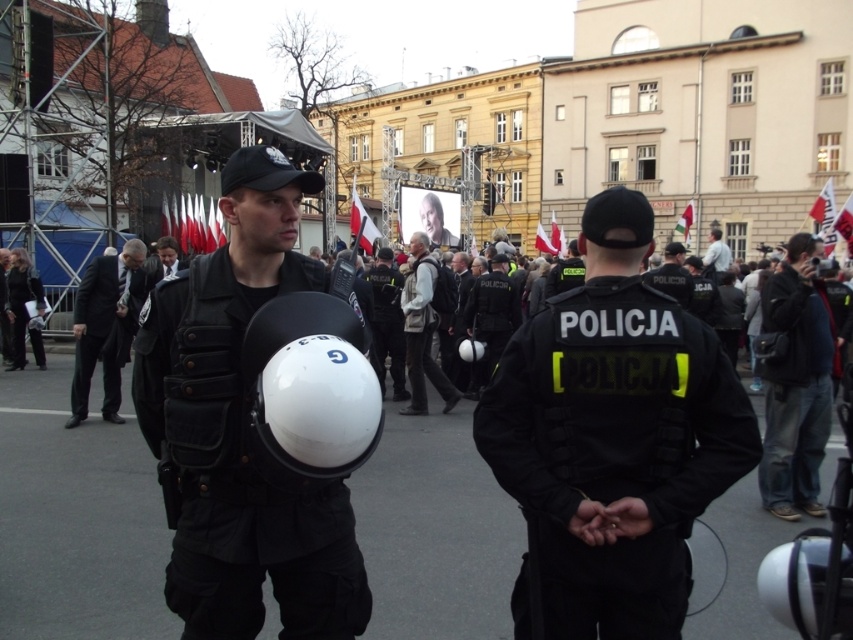
Question: Among these points, which one is nearest to the camera?

Choices:
 (A) (389, 280)
 (B) (769, 316)
 (C) (306, 390)

Answer: (C)

Question: Considering the real-world distances, which object is closest to the black uniformed officer at center?

Choices:
 (A) black suit at left
 (B) light gray shirt at upper right
 (C) light gray fabric jacket at center
 (D) dark blue jeans at center

Answer: (C)

Question: Where is dark blue jeans at center located in relation to black uniformed officer at center in the image?

Choices:
 (A) left
 (B) right

Answer: (B)

Question: Which point appears closest to the camera in this image?

Choices:
 (A) (299, 483)
 (B) (206, 272)
 (C) (509, 308)
 (D) (704, 266)

Answer: (A)

Question: Does white matte helmet at center appear under black uniformed officer at center?

Choices:
 (A) yes
 (B) no

Answer: (A)

Question: Does black suit at left have a lesser width compared to black uniformed officer at center?

Choices:
 (A) no
 (B) yes

Answer: (A)